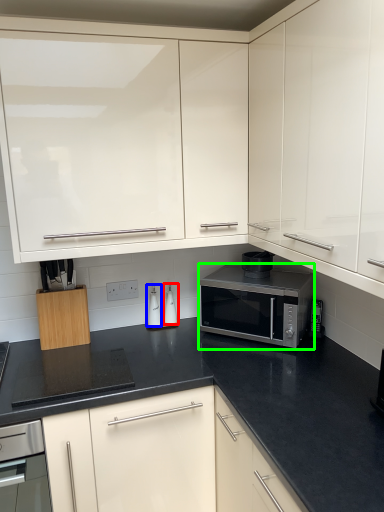
Question: Which object is the closest to the appliance (highlighted by a red box)? Choose among these: appliance (highlighted by a blue box) or microwave oven (highlighted by a green box).

Choices:
 (A) appliance
 (B) microwave oven

Answer: (A)